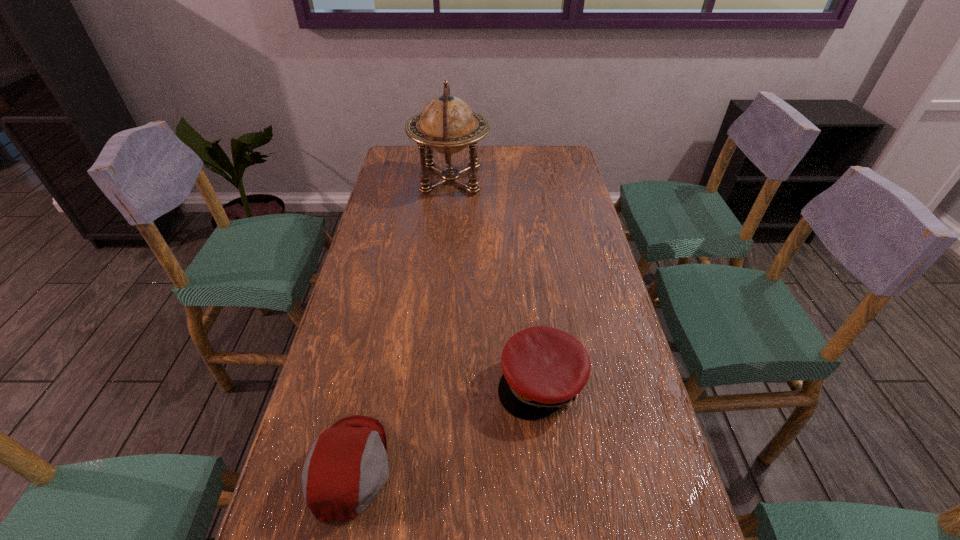
Where is `object located in the right edge section of the desktop`? This screenshot has height=540, width=960. object located in the right edge section of the desktop is located at coordinates (544, 368).

I want to click on object at the far left corner, so click(447, 124).

In the image, there is a desktop. Where is `vacant space at the far edge`? vacant space at the far edge is located at coordinates (510, 172).

You are a GUI agent. You are given a task and a screenshot of the screen. Output one action in this format:
    pyautogui.click(x=<x>, y=<y>)
    Task: Click on the vacant space at the left edge
    The width and height of the screenshot is (960, 540).
    Given the screenshot: What is the action you would take?
    pyautogui.click(x=415, y=184)

At what (x,y) coordinates should I click in order to perform the action: click on vacant space at the right edge of the desktop. Please return your answer as a coordinate pair (x, y). This screenshot has width=960, height=540. Looking at the image, I should click on (579, 406).

In the image, there is a desktop. Identify the location of vacant space at the far left corner. The width and height of the screenshot is (960, 540). (402, 160).

Identify the location of vacant space at the far right corner of the desktop. (552, 172).

At what (x,y) coordinates should I click in order to perform the action: click on free area in between the rightmost object and the left cap. Please return your answer as a coordinate pair (x, y). Looking at the image, I should click on [x=445, y=424].

Locate an element on the screen. vacant area between the globe and the right cap is located at coordinates (495, 281).

Where is `free point between the right cap and the left cap`? The width and height of the screenshot is (960, 540). free point between the right cap and the left cap is located at coordinates (445, 424).